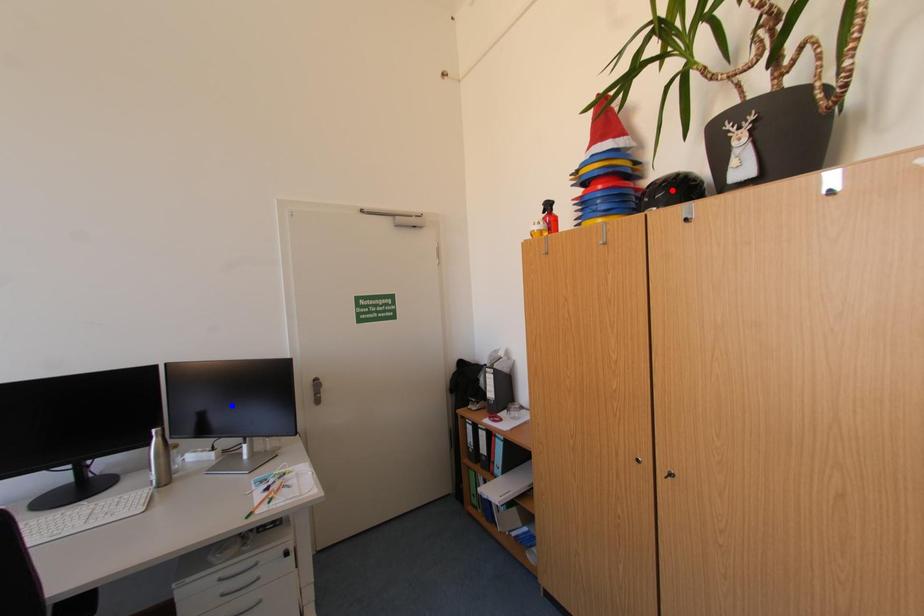
Question: Two points are marked on the image. Which point is closer to the camera?

Choices:
 (A) Blue point is closer.
 (B) Red point is closer.

Answer: (B)